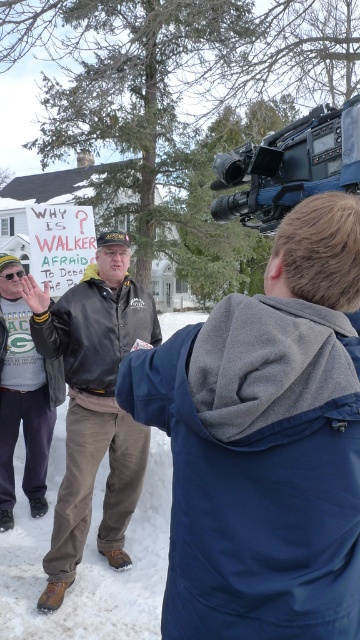
Question: Does leather jacket at center have a smaller size compared to black plastic video camera at upper right?

Choices:
 (A) no
 (B) yes

Answer: (A)

Question: Among these objects, which one is nearest to the camera?

Choices:
 (A) black plastic video camera at upper right
 (B) leather jacket at center

Answer: (A)

Question: Among these points, which one is nearest to the camera?

Choices:
 (A) (217, 212)
 (B) (73, 444)

Answer: (A)

Question: Is leather jacket at center smaller than black plastic video camera at upper right?

Choices:
 (A) no
 (B) yes

Answer: (A)

Question: Is leather jacket at center above black plastic video camera at upper right?

Choices:
 (A) yes
 (B) no

Answer: (B)